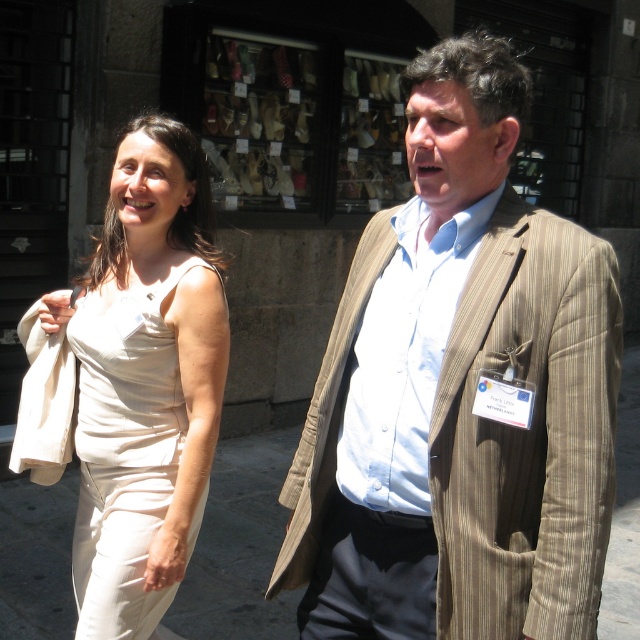
Does brown striped blazer at center have a greater width compared to beige fabric dress at left?

Yes.

Is brown striped blazer at center closer to camera compared to beige fabric dress at left?

Yes, it is in front of beige fabric dress at left.

Who is more distant from viewer, (477,429) or (125,378)?

The point (125,378) is behind.

Locate an element on the screen. brown striped blazer at center is located at coordinates (460, 394).